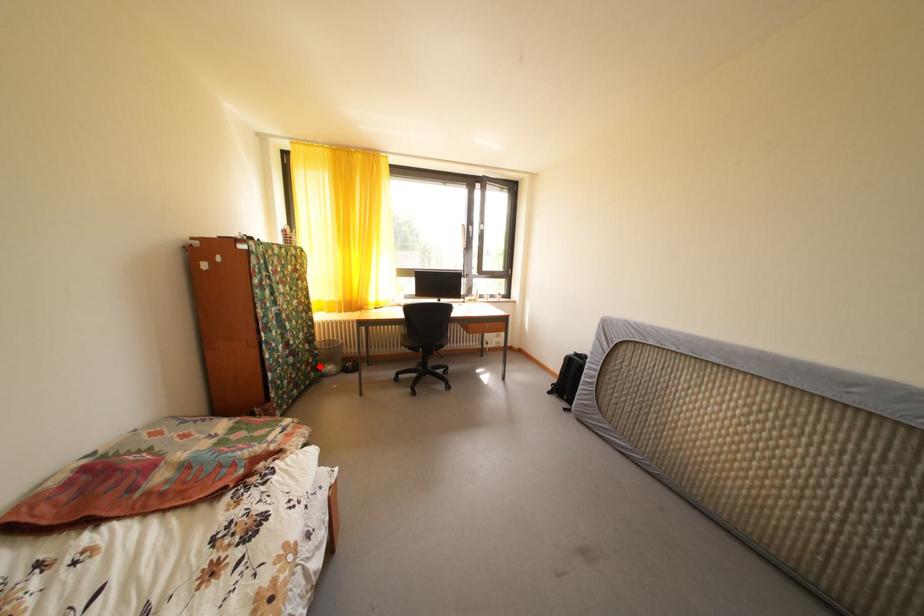
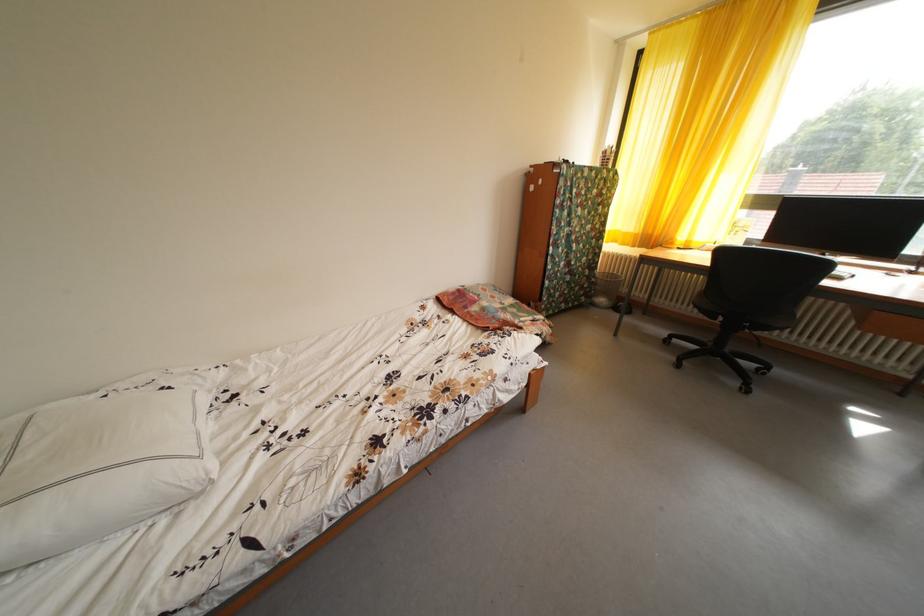
Locate, in the second image, the point that corresponds to the highlighted location in the first image.

(594, 292)